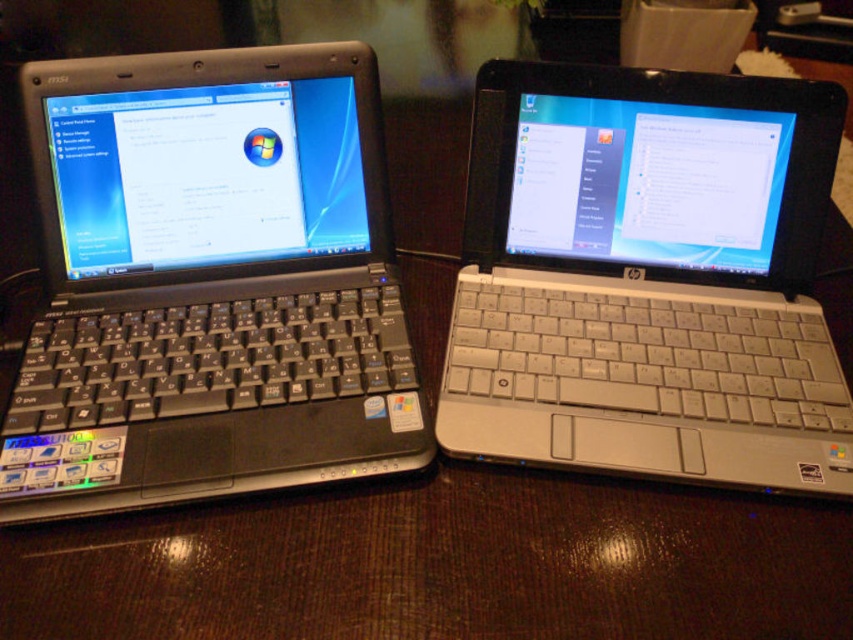
Question: Is silver matte laptop at center to the right of black plastic table at center from the viewer's perspective?

Choices:
 (A) yes
 (B) no

Answer: (A)

Question: Does silver matte laptop at center come in front of black plastic table at center?

Choices:
 (A) yes
 (B) no

Answer: (B)

Question: Which object appears farthest from the camera in this image?

Choices:
 (A) matte black laptop at left
 (B) silver matte laptop at center

Answer: (B)

Question: Based on their relative distances, which object is nearer to the matte black laptop at left?

Choices:
 (A) silver matte laptop at center
 (B) black plastic table at center

Answer: (B)

Question: Which object is the closest to the matte black laptop at left?

Choices:
 (A) silver matte laptop at center
 (B) black plastic table at center

Answer: (B)

Question: Does silver matte laptop at center come in front of black plastic table at center?

Choices:
 (A) no
 (B) yes

Answer: (A)